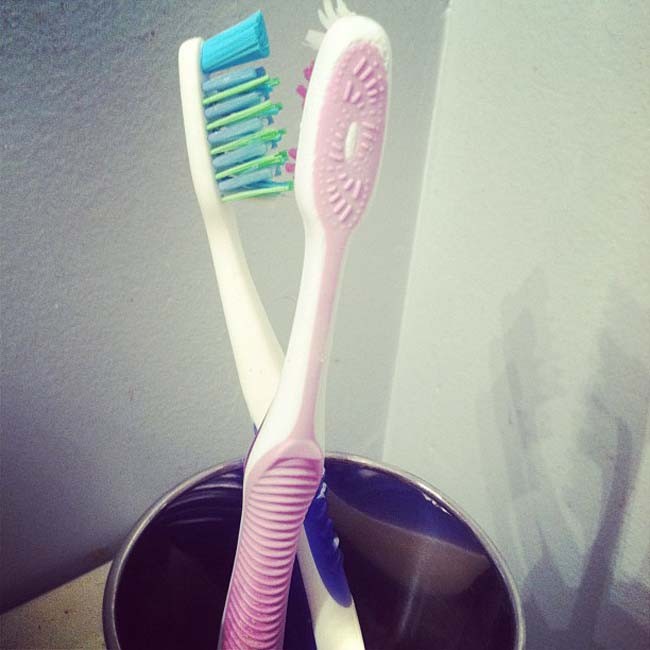
The height and width of the screenshot is (650, 650). Identify the location of shadows of toothbrush and cup. (621, 502), (537, 543), (604, 624).